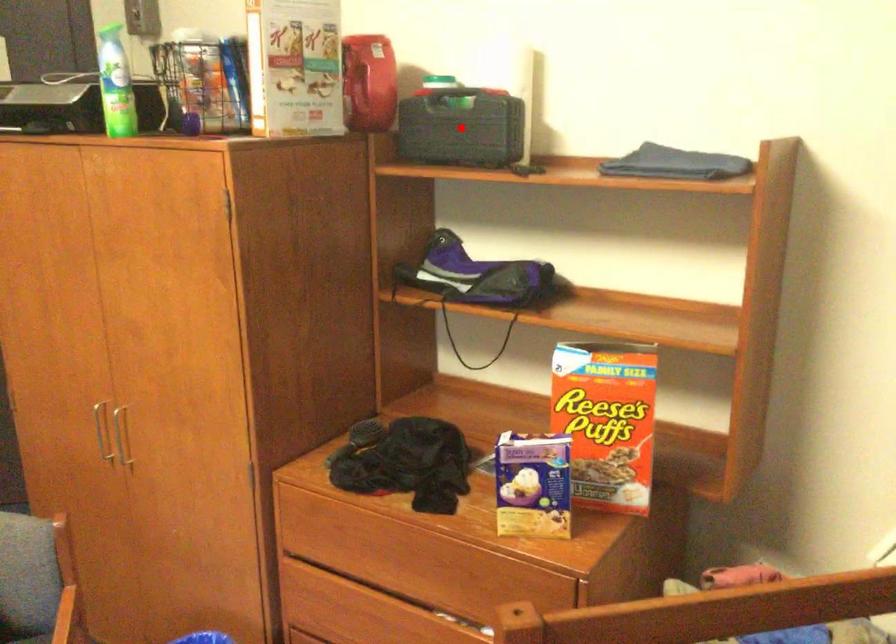
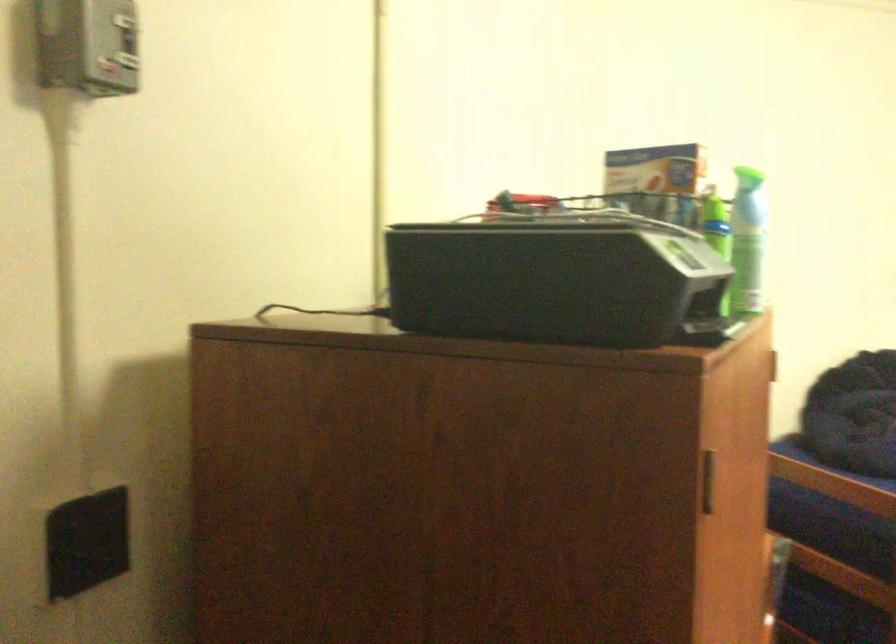
Question: I am providing you with two images of the same scene from different viewpoints. A red point is marked on the first image. Is the red point's position out of view in image 2?

Choices:
 (A) Yes
 (B) No

Answer: (A)